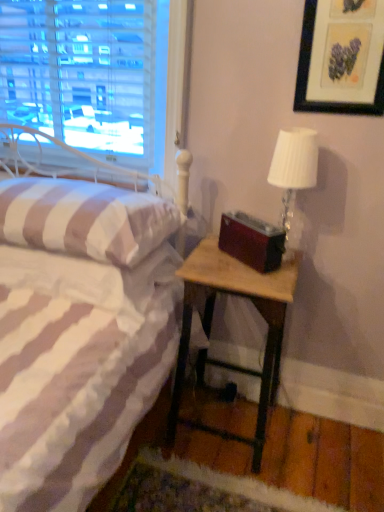
You are a GUI agent. You are given a task and a screenshot of the screen. Output one action in this format:
    pyautogui.click(x=<x>, y=<y>)
    Task: Click on the vacant space in front of wooden nightstand at lower right
    This screenshot has width=384, height=512.
    Given the screenshot: What is the action you would take?
    pyautogui.click(x=231, y=485)